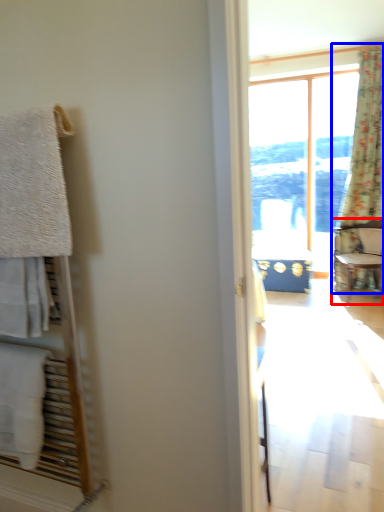
Question: Which point is further to the camera, chair (highlighted by a red box) or curtain (highlighted by a blue box)?

Choices:
 (A) chair
 (B) curtain

Answer: (B)